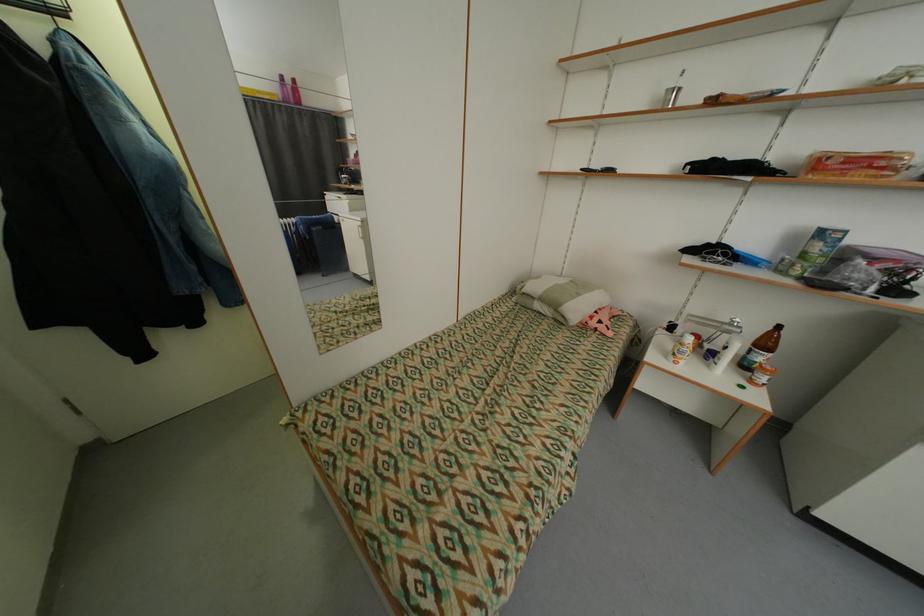
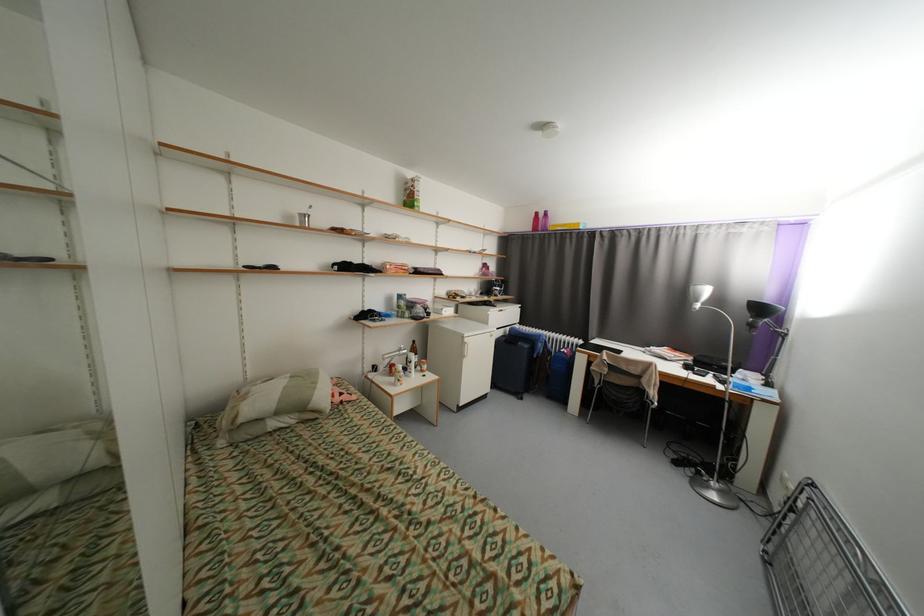
Where in the second image is the point corresponding to [585,296] from the first image?

(322, 384)